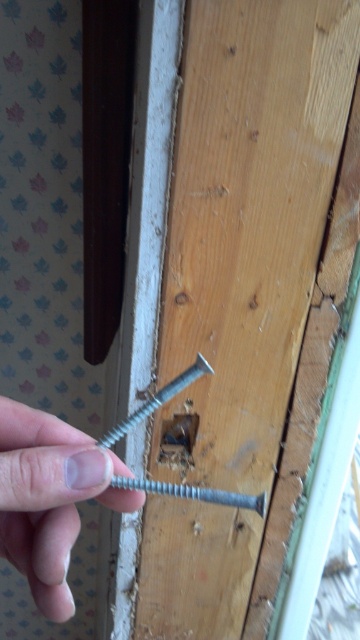
Which is behind, point (14, 497) or point (104, 468)?

The point (104, 468) is more distant.

Is pale skin at center taller than silver metallic bolt at center?

Correct, pale skin at center is much taller as silver metallic bolt at center.

Between point (34, 410) and point (68, 467), which one is positioned behind?

Point (34, 410)

I want to click on pale skin at center, so click(x=50, y=497).